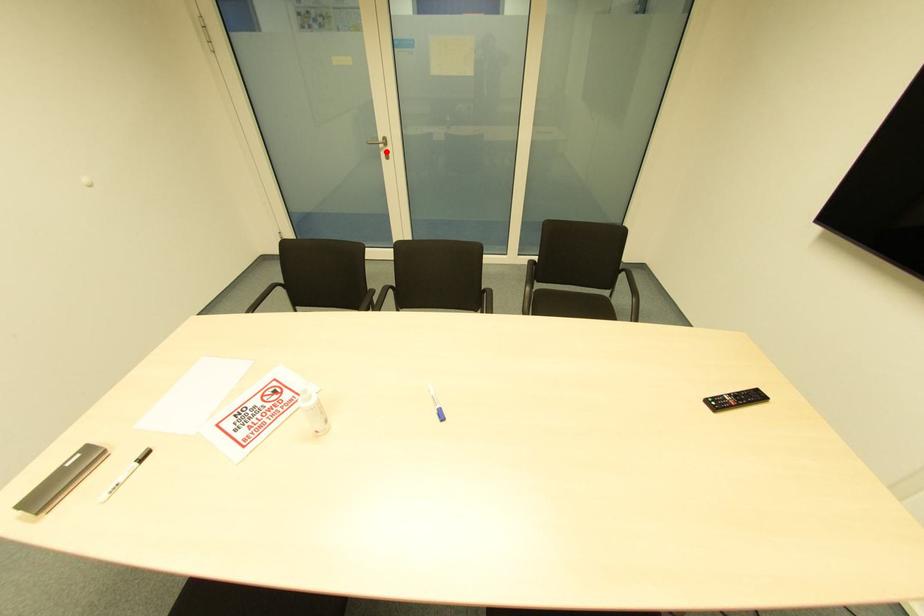
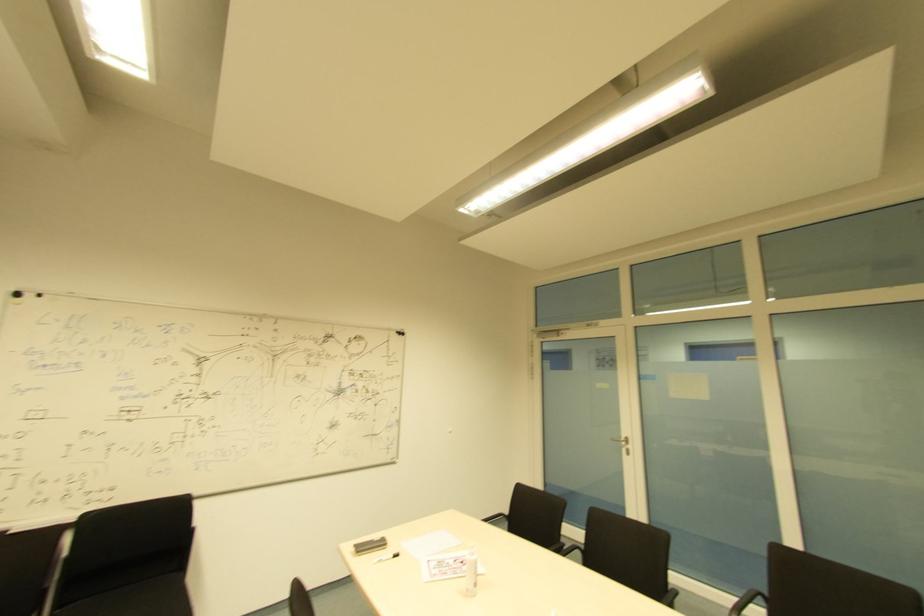
Question: A red point is marked in image1. In image2, is the corresponding 3D point closer to the camera or farther? Reply with the corresponding letter.

Choices:
 (A) The corresponding 3D point is closer.
 (B) The corresponding 3D point is farther.

Answer: (B)